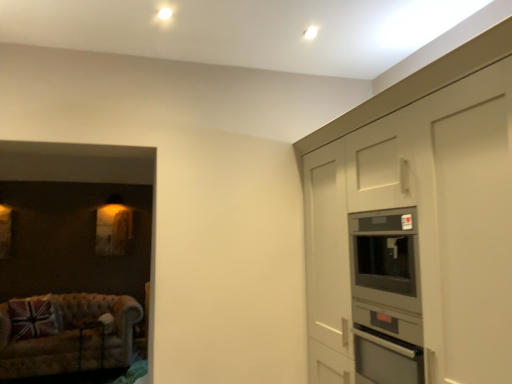
Describe the element at coordinates (72, 339) in the screenshot. I see `velvet beige couch at lower left` at that location.

What do you see at coordinates (415, 241) in the screenshot?
I see `matte gray cabinetry at right` at bounding box center [415, 241].

The height and width of the screenshot is (384, 512). What do you see at coordinates (34, 317) in the screenshot? I see `union jack fabric pillow at lower left` at bounding box center [34, 317].

Image resolution: width=512 pixels, height=384 pixels. Find the location of `velvet beige couch at lower left`. velvet beige couch at lower left is located at coordinates (72, 339).

Is metallic silver table at lower left in front of matte gray cabinetry at right?

No, metallic silver table at lower left is behind matte gray cabinetry at right.

From the image's perspective, is metallic silver table at lower left located above matte gray cabinetry at right?

No, from the image's perspective, metallic silver table at lower left is not above matte gray cabinetry at right.

Can you see metallic silver table at lower left touching matte gray cabinetry at right?

They are not placed beside each other.

Is metallic silver table at lower left facing towards matte gray cabinetry at right?

Yes, metallic silver table at lower left faces towards matte gray cabinetry at right.

Who is smaller, matte gray cabinetry at right or velvet beige couch at lower left?

Smaller between the two is velvet beige couch at lower left.

Can you tell me how much matte gray cabinetry at right and velvet beige couch at lower left differ in facing direction?

The angular difference between matte gray cabinetry at right and velvet beige couch at lower left is 94.9 degrees.

Is matte gray cabinetry at right aimed at velvet beige couch at lower left?

No, matte gray cabinetry at right does not turn towards velvet beige couch at lower left.

Can you confirm if matte gray cabinetry at right is positioned to the right of velvet beige couch at lower left?

Yes.

From a real-world perspective, does matte gray cabinetry at right stand above metallic silver table at lower left?

Indeed, from a real-world perspective, matte gray cabinetry at right stands above metallic silver table at lower left.

Is matte gray cabinetry at right positioned with its back to metallic silver table at lower left?

That's not correct — matte gray cabinetry at right is not looking away from metallic silver table at lower left.

Does point (331, 154) come farther from viewer compared to point (91, 321)?

No.

Is union jack fabric pillow at lower left behind metallic silver table at lower left?

Yes, it is.

From the image's perspective, between union jack fabric pillow at lower left and metallic silver table at lower left, who is located below?

metallic silver table at lower left is shown below in the image.

Between union jack fabric pillow at lower left and metallic silver table at lower left, which one has smaller size?

metallic silver table at lower left is smaller.

From the picture: How far apart are matte gray cabinetry at right and union jack fabric pillow at lower left?

matte gray cabinetry at right and union jack fabric pillow at lower left are 15.68 feet apart.

Is matte gray cabinetry at right shorter than union jack fabric pillow at lower left?

No.

Which object is further away from the camera, matte gray cabinetry at right or union jack fabric pillow at lower left?

union jack fabric pillow at lower left is further from the camera.

From a real-world perspective, between matte gray cabinetry at right and union jack fabric pillow at lower left, who is vertically lower?

From a 3D spatial view, union jack fabric pillow at lower left is below.

Is velvet beige couch at lower left to the left of metallic silver table at lower left from the viewer's perspective?

Yes.

Is velvet beige couch at lower left in front of or behind metallic silver table at lower left in the image?

Clearly, velvet beige couch at lower left is in front of metallic silver table at lower left.

Is velvet beige couch at lower left far away from metallic silver table at lower left?

No.

Does velvet beige couch at lower left have a lesser width compared to metallic silver table at lower left?

Incorrect, the width of velvet beige couch at lower left is not less than that of metallic silver table at lower left.

Is union jack fabric pillow at lower left to the left of velvet beige couch at lower left from the viewer's perspective?

Yes, union jack fabric pillow at lower left is to the left of velvet beige couch at lower left.

Based on the photo, from the image's perspective, is union jack fabric pillow at lower left located beneath velvet beige couch at lower left?

No, from the image's perspective, union jack fabric pillow at lower left is not below velvet beige couch at lower left.

Considering the sizes of objects union jack fabric pillow at lower left and velvet beige couch at lower left in the image provided, who is wider, union jack fabric pillow at lower left or velvet beige couch at lower left?

velvet beige couch at lower left is wider.

This screenshot has width=512, height=384. I want to click on studio couch that appears below the union jack fabric pillow at lower left (from a real-world perspective), so pos(72,339).

Find the location of a particular element. The width and height of the screenshot is (512, 384). table located underneath the matte gray cabinetry at right (from a real-world perspective) is located at coordinates (89, 328).

Image resolution: width=512 pixels, height=384 pixels. What are the coordinates of `studio couch located behind the matte gray cabinetry at right` in the screenshot? It's located at (72, 339).

Based on their spatial positions, is matte gray cabinetry at right or union jack fabric pillow at lower left further from velvet beige couch at lower left?

matte gray cabinetry at right is further to velvet beige couch at lower left.

When comparing their distances from matte gray cabinetry at right, does velvet beige couch at lower left or metallic silver table at lower left seem closer?

velvet beige couch at lower left lies closer to matte gray cabinetry at right than the other object.

Based on the photo, looking at the image, which one is located closer to metallic silver table at lower left, matte gray cabinetry at right or union jack fabric pillow at lower left?

The object closer to metallic silver table at lower left is union jack fabric pillow at lower left.

Estimate the real-world distances between objects in this image. Which object is closer to velvet beige couch at lower left, matte gray cabinetry at right or metallic silver table at lower left?

Based on the image, metallic silver table at lower left appears to be nearer to velvet beige couch at lower left.

When comparing their distances from velvet beige couch at lower left, does union jack fabric pillow at lower left or matte gray cabinetry at right seem further?

Among the two, matte gray cabinetry at right is located further to velvet beige couch at lower left.

Based on their spatial positions, is metallic silver table at lower left or union jack fabric pillow at lower left further from velvet beige couch at lower left?

union jack fabric pillow at lower left is positioned further to the anchor velvet beige couch at lower left.

When comparing their distances from union jack fabric pillow at lower left, does metallic silver table at lower left or matte gray cabinetry at right seem further?

matte gray cabinetry at right lies further to union jack fabric pillow at lower left than the other object.

Based on their spatial positions, is velvet beige couch at lower left or union jack fabric pillow at lower left further from matte gray cabinetry at right?

union jack fabric pillow at lower left.

Locate an element on the screen. Image resolution: width=512 pixels, height=384 pixels. studio couch between matte gray cabinetry at right and metallic silver table at lower left along the z-axis is located at coordinates (72, 339).

I want to click on studio couch situated between union jack fabric pillow at lower left and matte gray cabinetry at right from left to right, so click(x=72, y=339).

What are the coordinates of `table between matte gray cabinetry at right and union jack fabric pillow at lower left in the front-back direction` in the screenshot? It's located at (89, 328).

At what (x,y) coordinates should I click in order to perform the action: click on studio couch situated between union jack fabric pillow at lower left and metallic silver table at lower left from left to right. Please return your answer as a coordinate pair (x, y). Image resolution: width=512 pixels, height=384 pixels. Looking at the image, I should click on (72, 339).